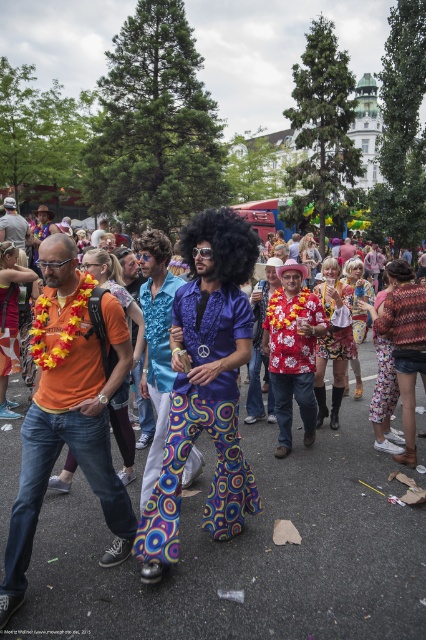
Question: Which point is farther to the camera?

Choices:
 (A) orange fabric shirt at left
 (B) vibrant polyester afro wig at center
 (C) afro wig at center

Answer: (C)

Question: Is afro wig at center bigger than vibrant multicolored wig at center?

Choices:
 (A) yes
 (B) no

Answer: (B)

Question: Does vivid multicolored pants at center have a lesser width compared to afro wig at center?

Choices:
 (A) no
 (B) yes

Answer: (A)

Question: Estimate the real-world distances between objects in this image. Which object is closer to the orange fabric shirt at left?

Choices:
 (A) floral fabric shirt at center
 (B) vibrant polyester afro wig at center

Answer: (B)

Question: Estimate the real-world distances between objects in this image. Which object is farther from the orange fabric shirt at left?

Choices:
 (A) floral fabric shirt at center
 (B) vibrant printed pants at center
 (C) vibrant polyester afro wig at center
 (D) vibrant multicolored wig at center

Answer: (A)

Question: Can you confirm if orange fabric shirt at left is bigger than vibrant multicolored wig at center?

Choices:
 (A) yes
 (B) no

Answer: (B)